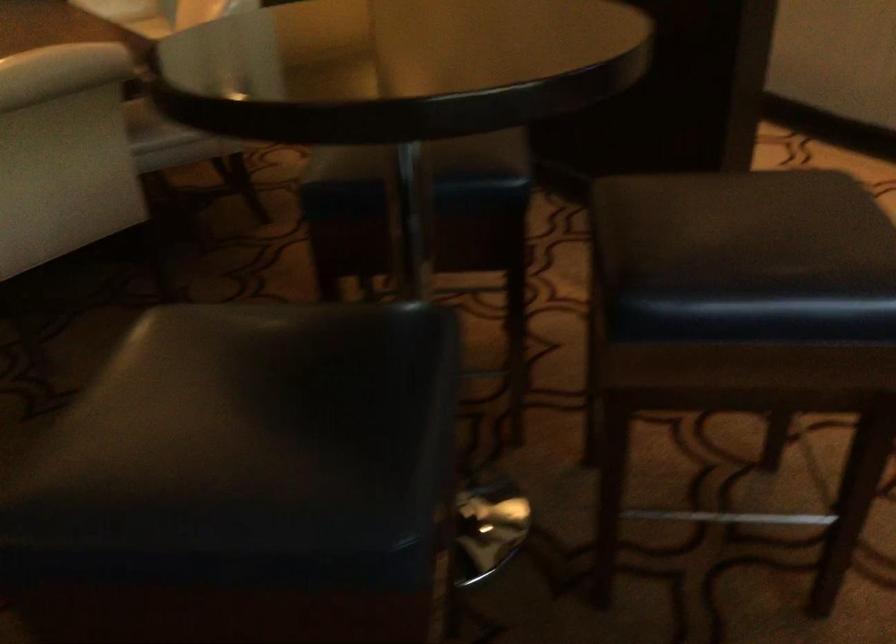
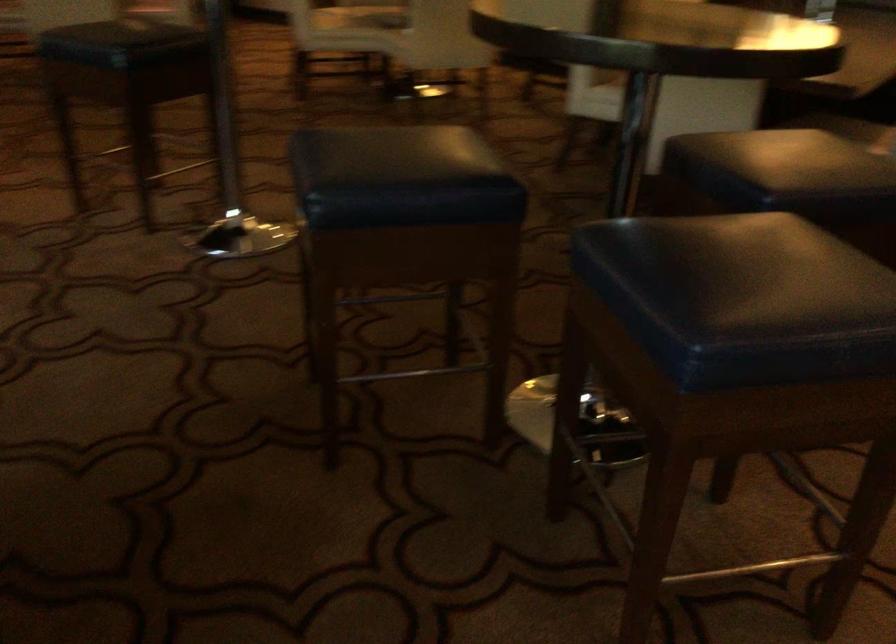
The point at (510, 142) is marked in the first image. Where is the corresponding point in the second image?

(778, 167)